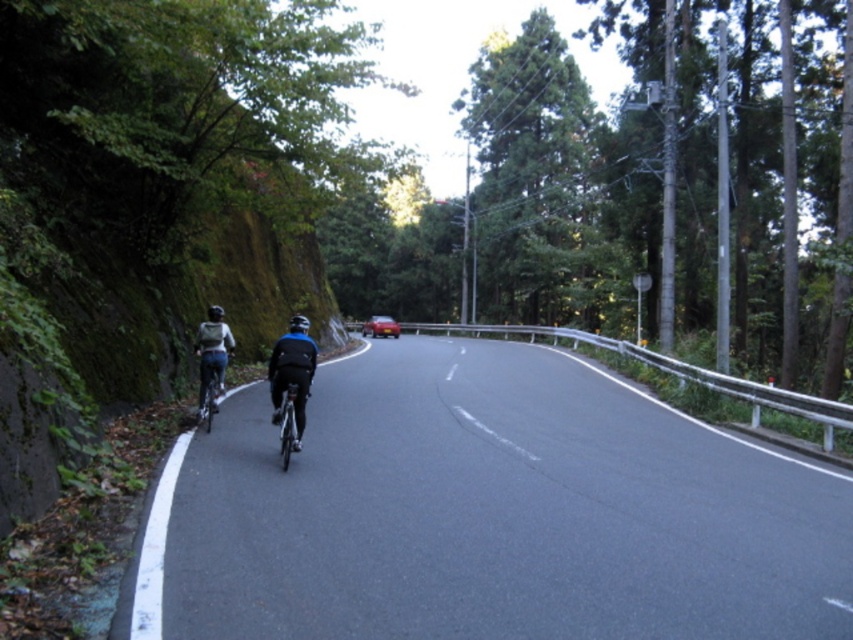
Who is lower down, black asphalt road at center or blue fabric jacket at center?

black asphalt road at center is below.

Identify the location of black asphalt road at center. (486, 513).

Identify the location of black asphalt road at center. (486, 513).

Which is behind, point (389, 317) or point (219, 317)?

Positioned behind is point (389, 317).

Is shiny red car at center thinner than shiny black helmet at upper center?

No, shiny red car at center is not thinner than shiny black helmet at upper center.

What do you see at coordinates (380, 326) in the screenshot?
I see `shiny red car at center` at bounding box center [380, 326].

This screenshot has width=853, height=640. In order to click on shiny red car at center in this screenshot , I will do tap(380, 326).

Consider the image. Is black asphalt road at center wider than shiny black helmet at upper center?

Indeed, black asphalt road at center has a greater width compared to shiny black helmet at upper center.

Between black asphalt road at center and shiny black helmet at upper center, which one appears on the right side from the viewer's perspective?

black asphalt road at center is more to the right.

Is point (311, 592) in front of point (218, 308)?

Yes, point (311, 592) is closer to viewer.

The height and width of the screenshot is (640, 853). In order to click on black asphalt road at center in this screenshot , I will do `click(486, 513)`.